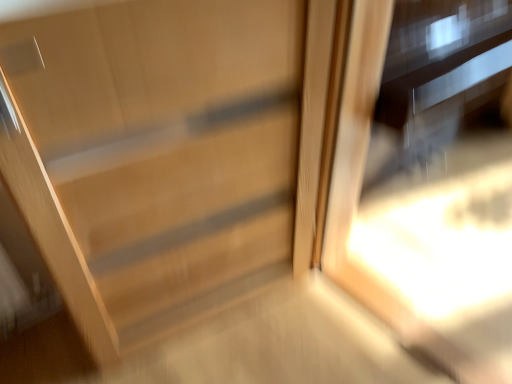
Find the location of `vacant location below transparent glass window at right (from a real-world perspective)`. vacant location below transparent glass window at right (from a real-world perspective) is located at coordinates (432, 342).